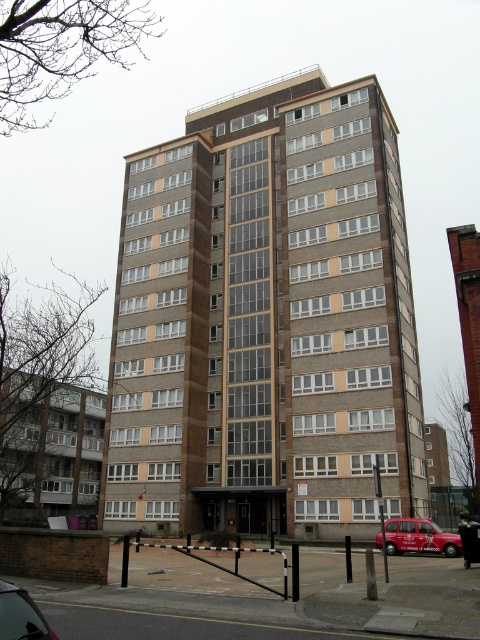
You are standing in front of the residential building and see the red matte taxi at lower right and the metallic silver car at lower left. Which vehicle is positioned closer to the right side of the building?

The red matte taxi at lower right is positioned closer to the right side of the building compared to the metallic silver car at lower left.

In the scene shown: You are standing at the base of the residential building and looking up at its facade. You notice two points marked on the building. The first point is at coordinates point (408, 520) and the second is at point (4, 620). From your vantage point, which of these points is closer to you?

Point (4, 620) is closer to you because it is in front of point (408, 520).

You are a pedestrian standing in front of the residential building. You see a red matte taxi at lower right and a metallic silver car at lower left. Which vehicle is closer to the base of the building?

The red matte taxi at lower right is closer to the base of the building because it is located below the metallic silver car at lower left.